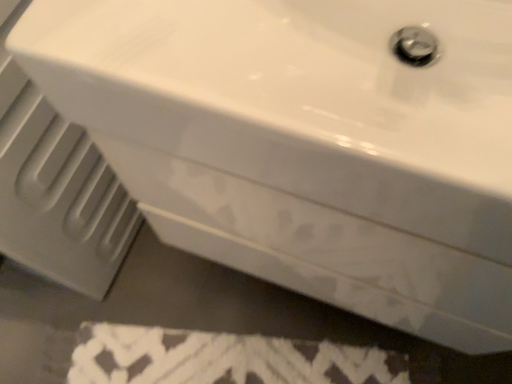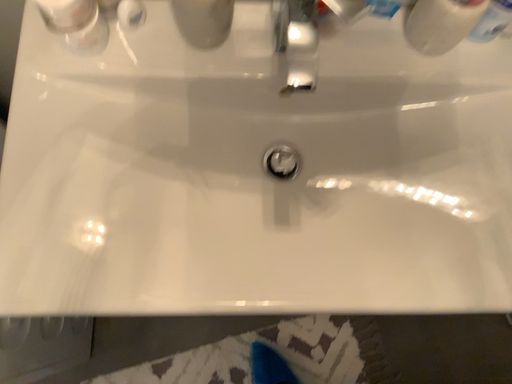
Question: How did the camera likely rotate when shooting the video?

Choices:
 (A) rotated downward
 (B) rotated upward

Answer: (A)